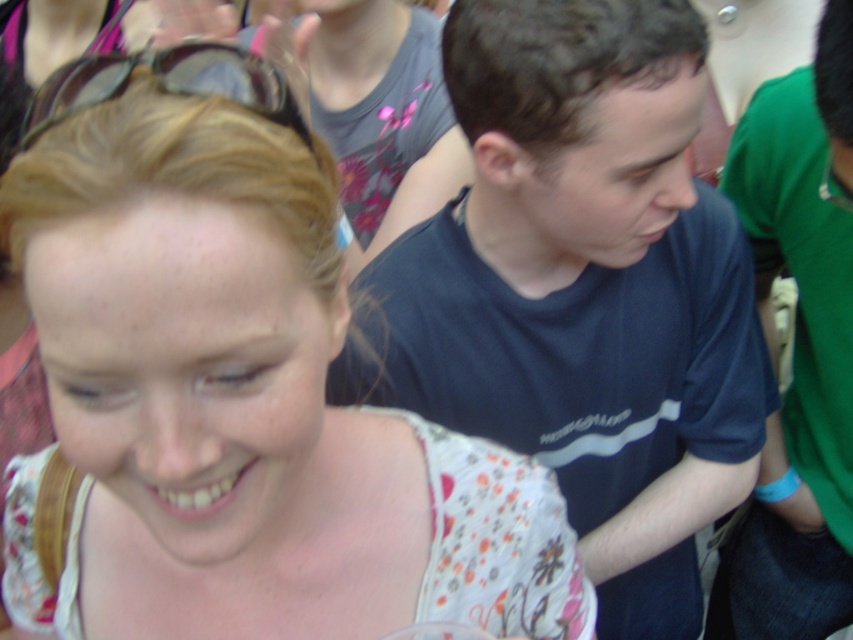
You are a fashion designer observing the image. You need to decide which item is wider between the floral fabric dress at center and the black plastic goggles at upper left. Which one is wider?

The floral fabric dress at center is wider than the black plastic goggles at upper left as stated in the description.

You are standing at the origin point in the image. Which object is located at the coordinates point (582, 291)?

The dark blue t shirt at center is located at point (582, 291).